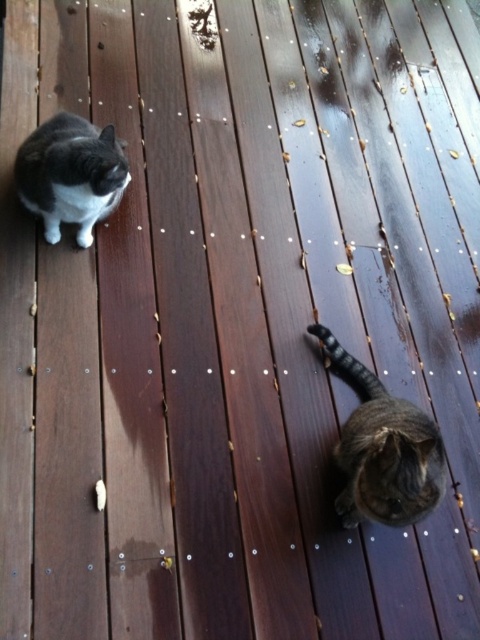
Does point (364, 442) come closer to viewer compared to point (81, 172)?

No, it is not.

Is brown fur cat at lower right to the right of gray-white fur cat at upper left from the viewer's perspective?

Indeed, brown fur cat at lower right is positioned on the right side of gray-white fur cat at upper left.

At what (x,y) coordinates should I click in order to perform the action: click on brown fur cat at lower right. Please return your answer as a coordinate pair (x, y). This screenshot has width=480, height=640. Looking at the image, I should click on (384, 451).

The width and height of the screenshot is (480, 640). What are the coordinates of `brown fur cat at lower right` in the screenshot? It's located at (384, 451).